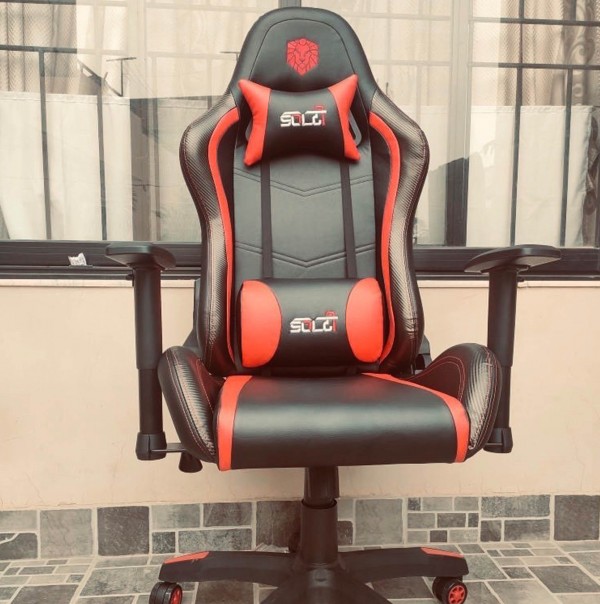
At what (x,y) coordinates should I click in order to perform the action: click on the right arm rest. Please return your answer as a coordinate pair (x, y). The height and width of the screenshot is (604, 600). Looking at the image, I should click on (133, 249).